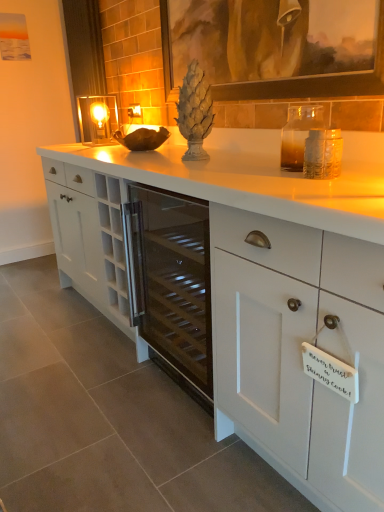
Question: From the image's perspective, is matte brown picture frame at upper center located above or below white matte cabinet at center?

Choices:
 (A) above
 (B) below

Answer: (A)

Question: Visually, is matte brown picture frame at upper center positioned to the left or to the right of white matte cabinet at center?

Choices:
 (A) right
 (B) left

Answer: (B)

Question: Estimate the real-world distances between objects in this image. Which object is closer to the white matte cabinet at center?

Choices:
 (A) matte brown picture frame at upper center
 (B) matte glass electric outlet at center
 (C) matte glass candle holder at upper left

Answer: (A)

Question: Based on their relative distances, which object is farther from the matte brown picture frame at upper center?

Choices:
 (A) matte glass electric outlet at center
 (B) matte glass candle holder at upper left
 (C) white matte cabinet at center

Answer: (A)